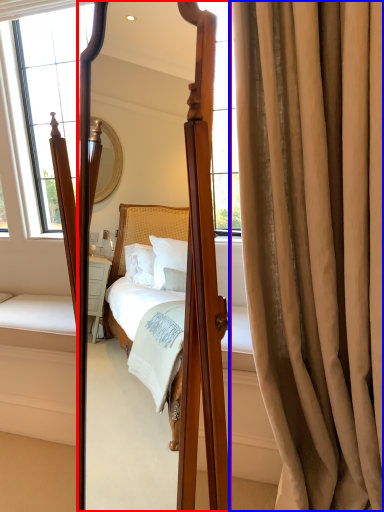
Question: Which object appears farthest to the camera in this image, mirror (highlighted by a red box) or curtain (highlighted by a blue box)?

Choices:
 (A) mirror
 (B) curtain

Answer: (B)